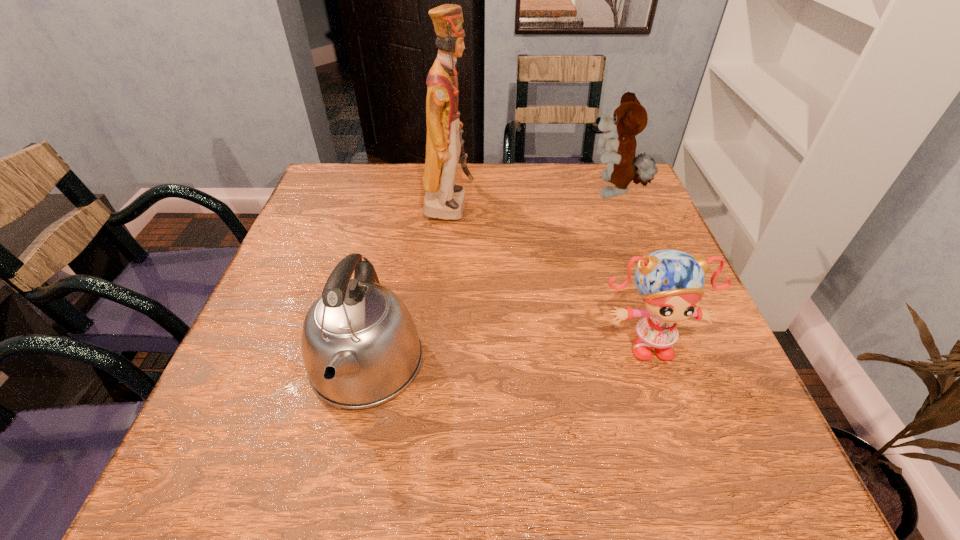
Where is `the tallest object`? This screenshot has width=960, height=540. the tallest object is located at coordinates pos(444,199).

You are a GUI agent. You are given a task and a screenshot of the screen. Output one action in this format:
    pyautogui.click(x=<x>, y=<y>)
    Task: Click on the puppy
    The width and height of the screenshot is (960, 540).
    Given the screenshot: What is the action you would take?
    pyautogui.click(x=629, y=118)

This screenshot has height=540, width=960. Identify the location of kettle. (360, 346).

This screenshot has width=960, height=540. Identify the location of doll. (670, 281).

Locate an element on the screen. The image size is (960, 540). vacant space situated on the front-facing side of the tallest object is located at coordinates (604, 205).

Where is `vacant space situated on the face of the puppy`? vacant space situated on the face of the puppy is located at coordinates (526, 192).

The image size is (960, 540). I want to click on free spot located 0.250m on the face of the puppy, so click(494, 192).

In order to click on vacant space located on the face of the puppy in this screenshot , I will do `click(548, 192)`.

This screenshot has height=540, width=960. I want to click on vacant area located 0.050m on the spout of the kettle, so click(344, 465).

Identify the location of free space located 0.200m on the face of the doll. (692, 477).